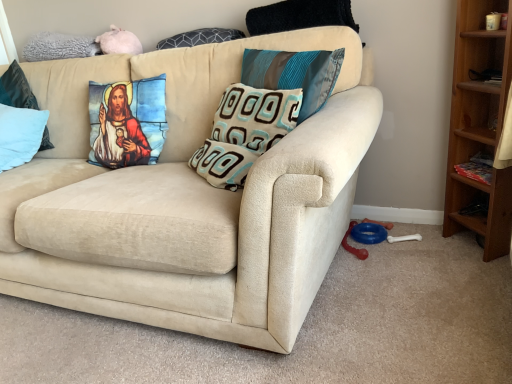
Question: Looking at the image, does teal silk pillow at upper center, the first pillow when ordered from right to left, seem bigger or smaller compared to beige textured pillow at center, which is the fourth pillow from left to right?

Choices:
 (A) big
 (B) small

Answer: (B)

Question: From the image's perspective, is teal silk pillow at upper center, the first pillow when ordered from right to left, above or below beige textured pillow at center, which is the fourth pillow from left to right?

Choices:
 (A) below
 (B) above

Answer: (B)

Question: Estimate the real-world distances between objects in this image. Which object is farther from the light blue fabric pillow at left, which appears as the 4th pillow when viewed from the right?

Choices:
 (A) dark gray textured pillow at upper center, the 3th pillow in the left-to-right sequence
 (B) beige suede couch at center
 (C) beige textured pillow at center, which is the 2th pillow in right-to-left order
 (D) light blue fabric pillow at left, the first pillow in the left-to-right sequence
 (E) teal silk pillow at upper center, the first pillow when ordered from right to left

Answer: (E)

Question: Based on their relative distances, which object is nearer to the beige suede couch at center?

Choices:
 (A) beige textured pillow at center, which is the 2th pillow in right-to-left order
 (B) teal silk pillow at upper center, the first pillow when ordered from right to left
 (C) light blue fabric pillow at left, which appears as the 2th pillow when viewed from the left
 (D) light blue fabric pillow at left, the first pillow in the left-to-right sequence
 (E) dark gray textured pillow at upper center, arranged as the third pillow when viewed from the right

Answer: (A)